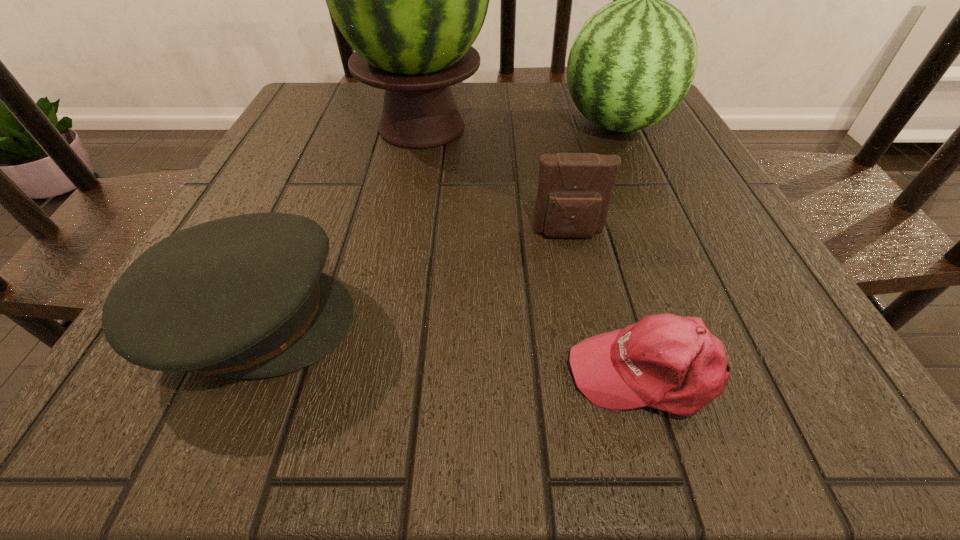
Where is `the taller watermelon`? the taller watermelon is located at coordinates (411, 0).

You are a GUI agent. You are given a task and a screenshot of the screen. Output one action in this format:
    pyautogui.click(x=<x>, y=<y>)
    Task: Click on the left watermelon
    This screenshot has height=540, width=960.
    Given the screenshot: What is the action you would take?
    pyautogui.click(x=411, y=0)

Locate an element on the screen. This screenshot has width=960, height=540. the shorter watermelon is located at coordinates (633, 61).

Identify the location of the fourth shortest object. Image resolution: width=960 pixels, height=540 pixels. (633, 61).

Where is `the third farthest object`? the third farthest object is located at coordinates (574, 194).

The width and height of the screenshot is (960, 540). What are the coordinates of `beret` in the screenshot? It's located at (244, 296).

Locate an element on the screen. The height and width of the screenshot is (540, 960). baseball cap is located at coordinates (672, 363).

Locate an element on the screen. vacant space located on the front of the tallest object is located at coordinates (397, 259).

Find the location of a particular element. free space located 0.070m on the left of the fourth shortest object is located at coordinates (528, 125).

You are a GUI agent. You are given a task and a screenshot of the screen. Output one action in this format:
    pyautogui.click(x=<x>, y=<y>)
    Task: Click on the vacant area situated with an open flap on the pouch
    
    Given the screenshot: What is the action you would take?
    pyautogui.click(x=583, y=301)